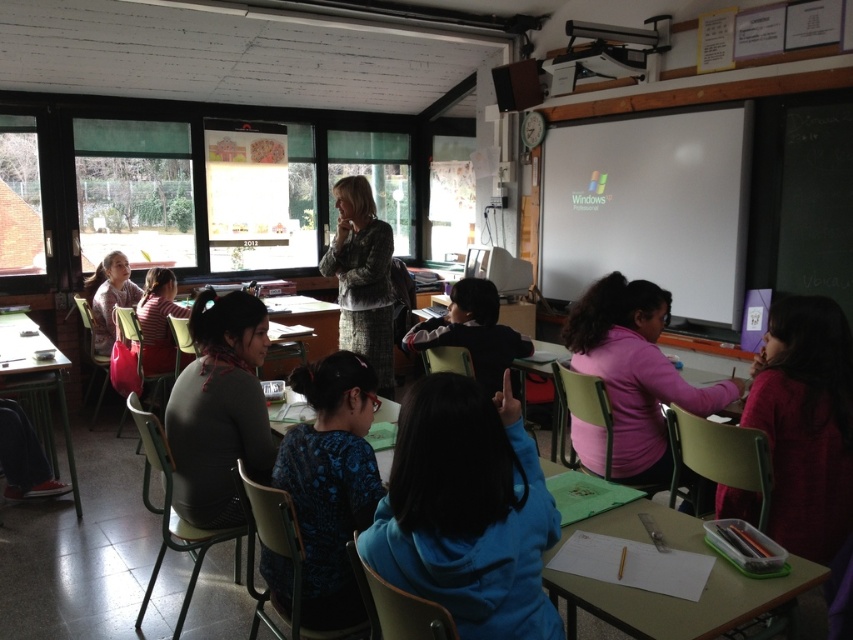
Question: Is blue fleece jacket at center below patterned fabric jacket at center?

Choices:
 (A) no
 (B) yes

Answer: (B)

Question: Which of the following is the farthest from the observer?

Choices:
 (A) green plastic table at center
 (B) patterned fabric jacket at center

Answer: (B)

Question: Is blue fleece jacket at center below patterned fabric jacket at center?

Choices:
 (A) yes
 (B) no

Answer: (A)

Question: Based on their relative distances, which object is nearer to the wooden desk at lower left?

Choices:
 (A) blue fleece jacket at center
 (B) dark blue sweater at center
 (C) pink matte shirt at center

Answer: (B)

Question: Which point is closer to the camera?

Choices:
 (A) blue fabric shirt at center
 (B) dark blue sweater at center
 (C) patterned fabric jacket at center
 (D) pink matte shirt at center

Answer: (A)

Question: Is white matte projector screen at upper right thinner than green plastic table at center?

Choices:
 (A) no
 (B) yes

Answer: (A)